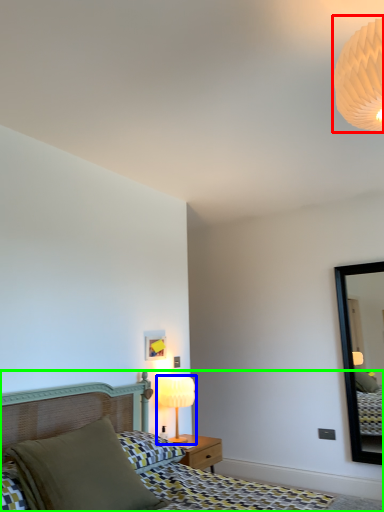
Question: Which is nearer to the lamp (highlighted by a red box)? table lamp (highlighted by a blue box) or bed (highlighted by a green box).

Choices:
 (A) table lamp
 (B) bed

Answer: (B)